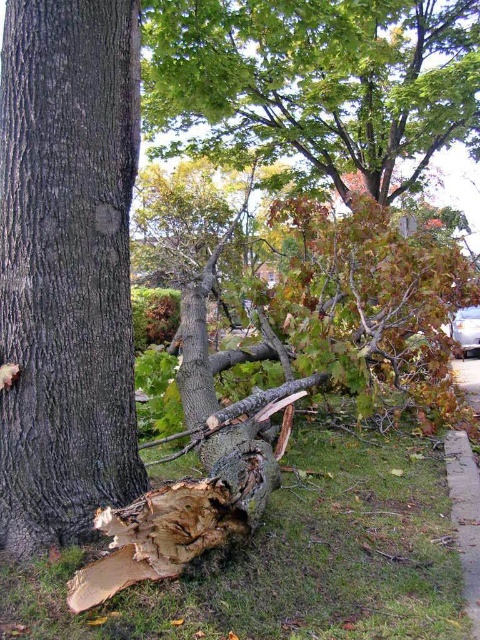
Question: Does dark brown rough bark at center have a smaller size compared to green leafy tree at center?

Choices:
 (A) no
 (B) yes

Answer: (B)

Question: Which of the following is the farthest from the observer?

Choices:
 (A) green leafy tree at center
 (B) dark brown rough bark at center

Answer: (A)

Question: Does dark brown rough bark at center have a smaller size compared to green leafy tree at center?

Choices:
 (A) yes
 (B) no

Answer: (A)

Question: From the image, what is the correct spatial relationship of dark brown rough bark at center in relation to green leafy tree at center?

Choices:
 (A) below
 (B) above

Answer: (A)

Question: Which point is farther from the camera taking this photo?

Choices:
 (A) (63, 19)
 (B) (176, 42)

Answer: (B)